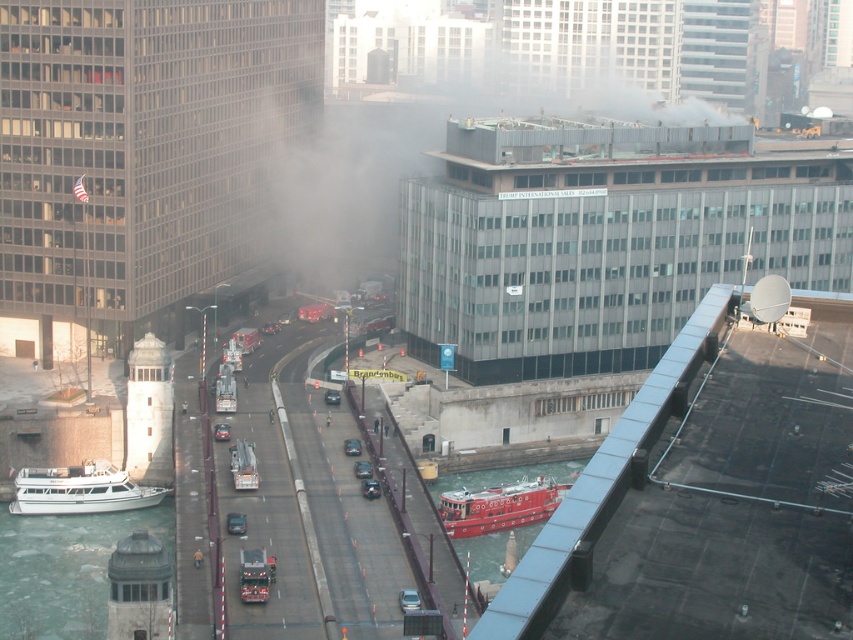
You are a firefighter trying to reach the fire at the TRUMP INTERNATIONAL HOTEL. You see the greenish water at lower left and the red rubber fireboat at center. Which object is closer to the fire location?

The red rubber fireboat at center is closer to the fire location because the greenish water at lower left is much taller than it, meaning the fireboat is positioned lower and nearer to the fire site.

You are a tourist standing on the bridge with the traffic cones. You see the smooth red boat at lower center and the white matte boat at lower left. Which boat is closer to your feet?

The smooth red boat at lower center is closer to your feet because it is positioned below the white matte boat at lower left, meaning it is situated lower in the scene and thus nearer to the bridge where you are standing.